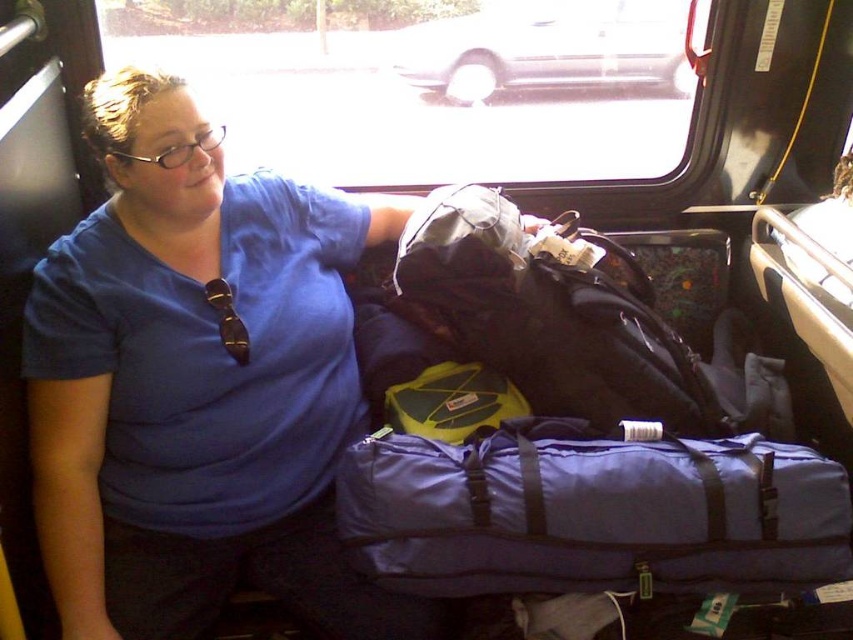
You are a passenger on a bus and you want to know if the purple nylon duffel bag at lower center is blocking the view of the white matte car at upper center outside through the window. Can you see the car through the window without the bag obstructing it?

The purple nylon duffel bag at lower center is below the white matte car at upper center, so the car is above the bag. Therefore, the bag does not block the view of the white matte car at upper center through the window.

You are a passenger on a bus and you want to check your clothing color. Which object is closer to you between the blue cotton shirt at left and the purple nylon duffel bag at lower center?

The blue cotton shirt at left is closer to you because it is in front of the purple nylon duffel bag at lower center.

You are a passenger on a bus and you see the blue cotton shirt at left and the purple nylon duffel bag at lower center. Which object is positioned higher in the scene?

The blue cotton shirt at left is positioned higher than the purple nylon duffel bag at lower center because it is above it.